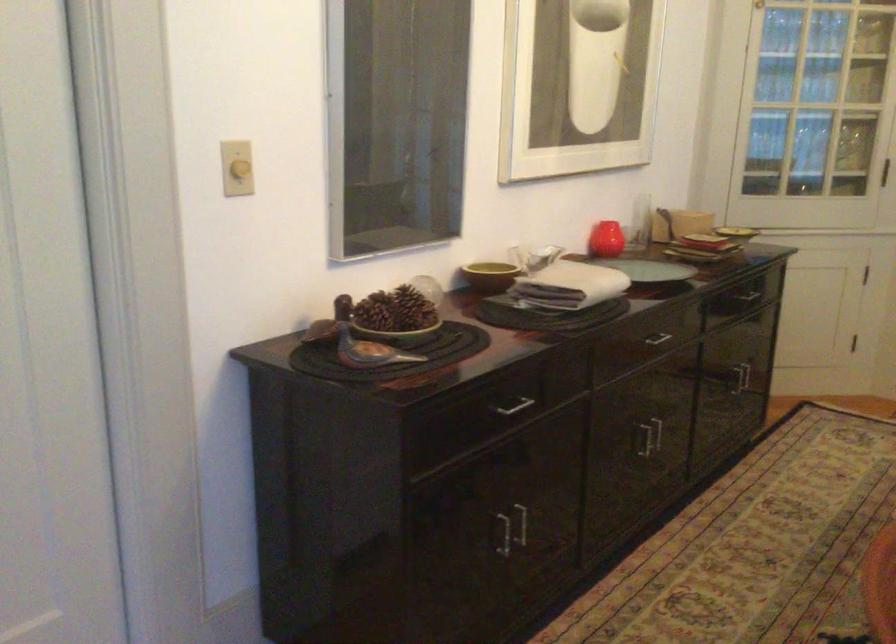
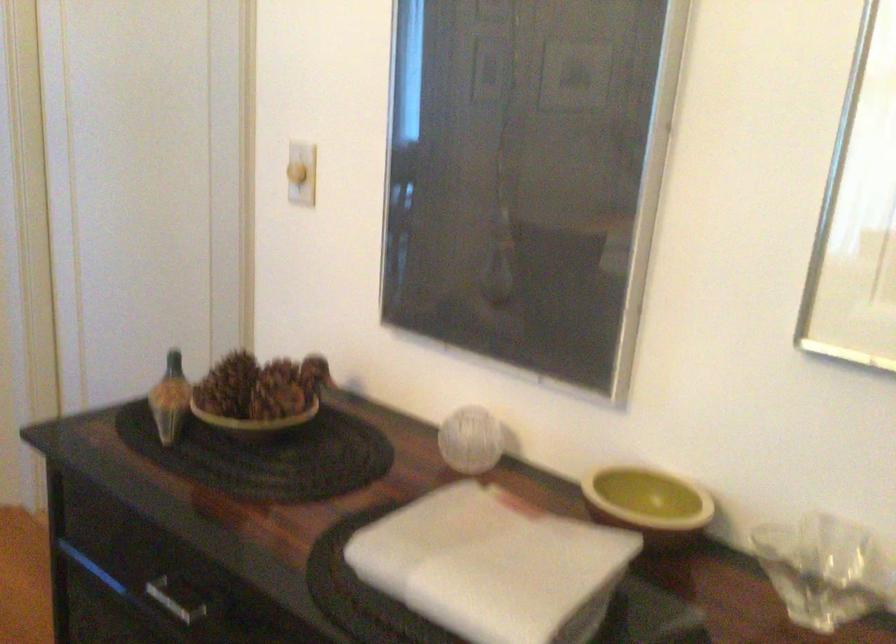
The point at (418, 296) is marked in the first image. Where is the corresponding point in the second image?

(259, 395)